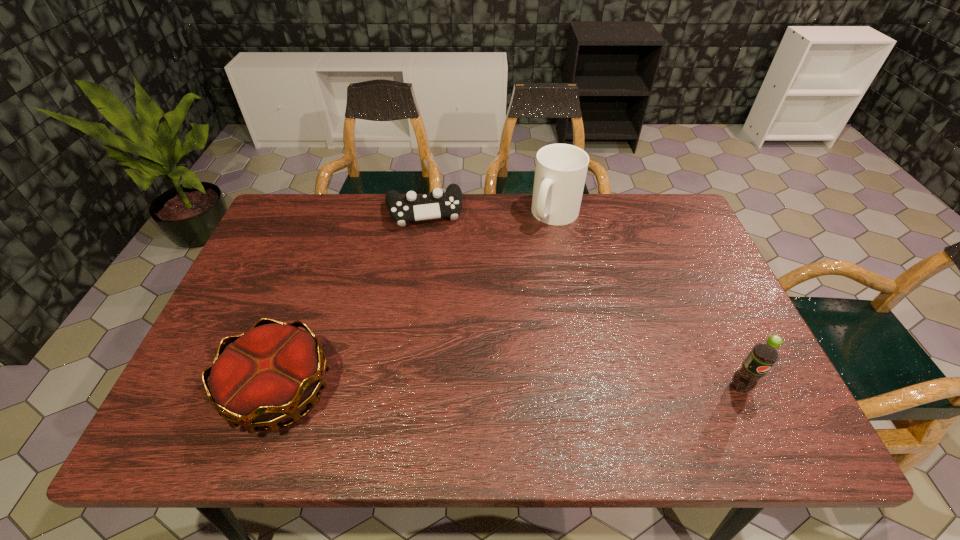
Locate an element on the screen. This screenshot has width=960, height=540. empty space that is in between the third object from right to left and the soda is located at coordinates (582, 299).

Locate an element on the screen. empty space that is in between the leftmost object and the soda is located at coordinates (511, 389).

What are the coordinates of `empty location between the rightmost object and the shortest object` in the screenshot? It's located at (582, 299).

Identify the location of free space between the second shortest object and the mug. (419, 302).

Locate an element on the screen. free space between the control and the crown is located at coordinates (352, 301).

What are the coordinates of `empty location between the third object from right to left and the second shortest object` in the screenshot? It's located at (352, 301).

Locate an element on the screen. Image resolution: width=960 pixels, height=540 pixels. free space between the second shortest object and the soda is located at coordinates coord(511,389).

You are a GUI agent. You are given a task and a screenshot of the screen. Output one action in this format:
    pyautogui.click(x=<x>, y=<y>)
    Task: Click on the free area in between the third object from left to right and the shortest object
    
    Given the screenshot: What is the action you would take?
    pyautogui.click(x=490, y=213)

At what (x,y) coordinates should I click in order to perform the action: click on the closest object to the mug. Please return your answer as a coordinate pair (x, y). This screenshot has height=540, width=960. Looking at the image, I should click on (413, 207).

Where is `object that stands as the closest to the mug`? This screenshot has width=960, height=540. object that stands as the closest to the mug is located at coordinates (413, 207).